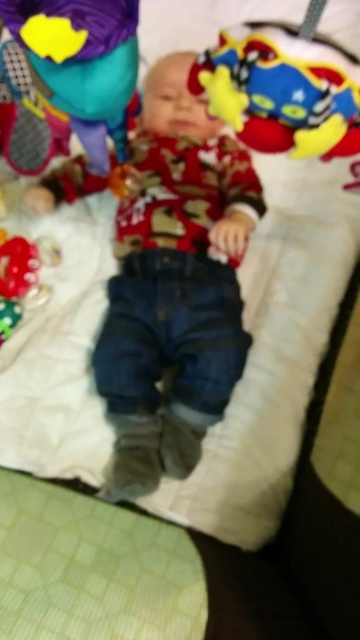
Is point (309, 115) behind point (124, 49)?

No.

Does soft plush toy at upper right have a smaller size compared to matte green plush toy at upper left?

Yes, soft plush toy at upper right is smaller than matte green plush toy at upper left.

What do you see at coordinates (280, 96) in the screenshot?
I see `soft plush toy at upper right` at bounding box center [280, 96].

Image resolution: width=360 pixels, height=640 pixels. I want to click on soft plush toy at upper right, so click(x=280, y=96).